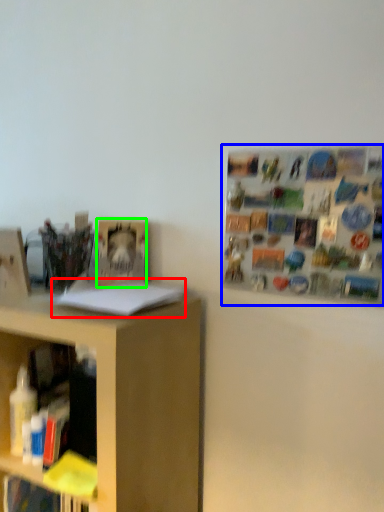
Question: Which is nearer to the book (highlighted by a red box)? bulletin board (highlighted by a blue box) or book (highlighted by a green box).

Choices:
 (A) bulletin board
 (B) book

Answer: (B)